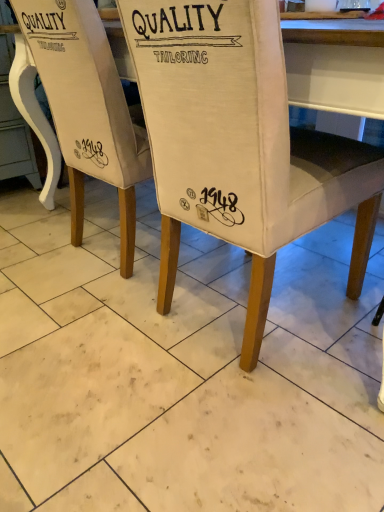
This screenshot has height=512, width=384. In order to click on free location to the left of white fabric chair at center, marked as the second chair in a left-to-right arrangement in this screenshot , I will do `click(75, 340)`.